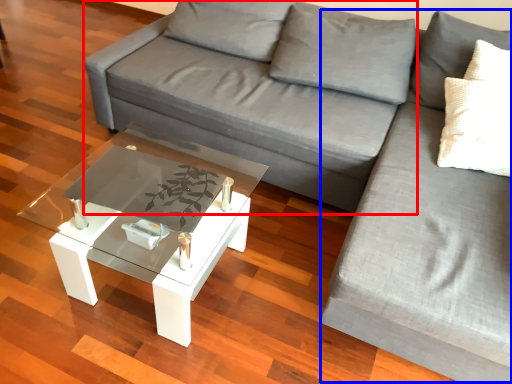
Question: Which object is further to the camera taking this photo, couch (highlighted by a red box) or couch (highlighted by a blue box)?

Choices:
 (A) couch
 (B) couch

Answer: (A)